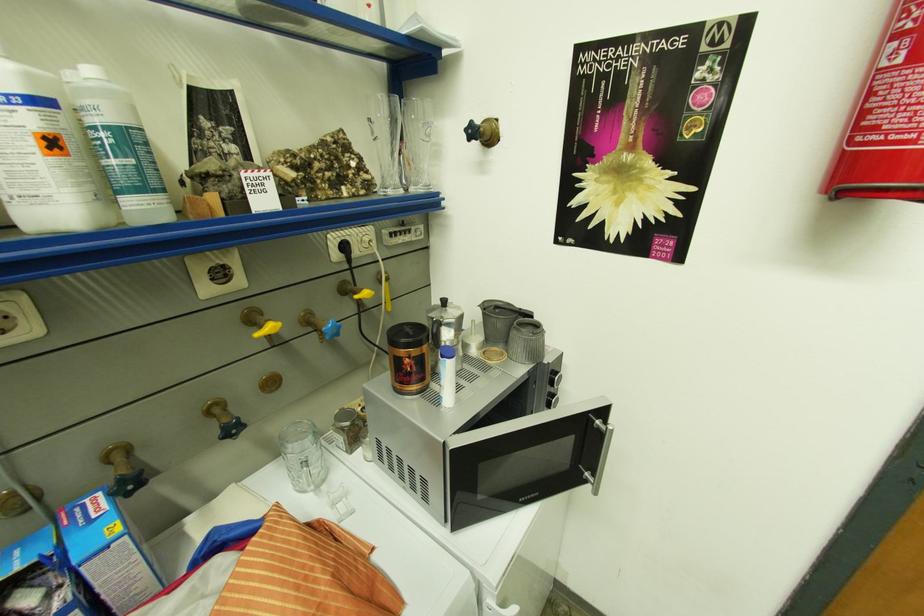
The height and width of the screenshot is (616, 924). Find the location of `moka pot handle`. moka pot handle is located at coordinates (444, 302).